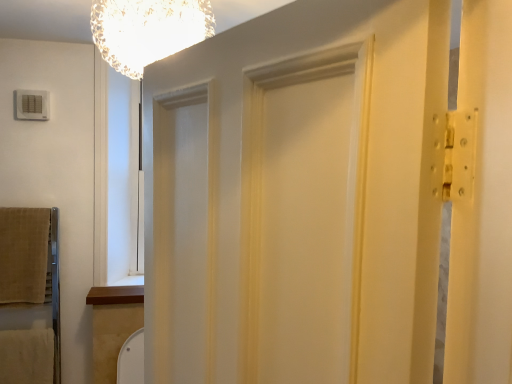
Question: Considering the relative sizes of translucent glass chandelier at upper center and white painted wood barn door at center in the image provided, is translucent glass chandelier at upper center taller than white painted wood barn door at center?

Choices:
 (A) yes
 (B) no

Answer: (B)

Question: Is translucent glass chandelier at upper center closer to the viewer compared to white painted wood barn door at center?

Choices:
 (A) no
 (B) yes

Answer: (A)

Question: Is translucent glass chandelier at upper center directly adjacent to white painted wood barn door at center?

Choices:
 (A) yes
 (B) no

Answer: (B)

Question: Could white painted wood barn door at center be considered to be inside translucent glass chandelier at upper center?

Choices:
 (A) yes
 (B) no

Answer: (B)

Question: Is translucent glass chandelier at upper center oriented towards white painted wood barn door at center?

Choices:
 (A) no
 (B) yes

Answer: (A)

Question: Is white painted wood barn door at center in front of or behind translucent glass chandelier at upper center in the image?

Choices:
 (A) behind
 (B) front

Answer: (B)

Question: Considering the positions of point (224, 74) and point (169, 18), is point (224, 74) closer or farther from the camera than point (169, 18)?

Choices:
 (A) farther
 (B) closer

Answer: (B)

Question: Is white painted wood barn door at center bigger or smaller than translucent glass chandelier at upper center?

Choices:
 (A) big
 (B) small

Answer: (A)

Question: In the image, is white painted wood barn door at center on the left side or the right side of translucent glass chandelier at upper center?

Choices:
 (A) left
 (B) right

Answer: (B)

Question: Is translucent glass chandelier at upper center bigger or smaller than beige soft towel at left?

Choices:
 (A) big
 (B) small

Answer: (A)

Question: Is translucent glass chandelier at upper center inside or outside of beige soft towel at left?

Choices:
 (A) outside
 (B) inside

Answer: (A)

Question: From the image's perspective, is translucent glass chandelier at upper center above or below beige soft towel at left?

Choices:
 (A) above
 (B) below

Answer: (A)

Question: Considering their positions, is translucent glass chandelier at upper center located in front of or behind beige soft towel at left?

Choices:
 (A) behind
 (B) front

Answer: (B)

Question: Is beige soft towel at left inside or outside of translucent glass chandelier at upper center?

Choices:
 (A) inside
 (B) outside

Answer: (B)

Question: From their relative heights in the image, would you say beige soft towel at left is taller or shorter than translucent glass chandelier at upper center?

Choices:
 (A) tall
 (B) short

Answer: (A)